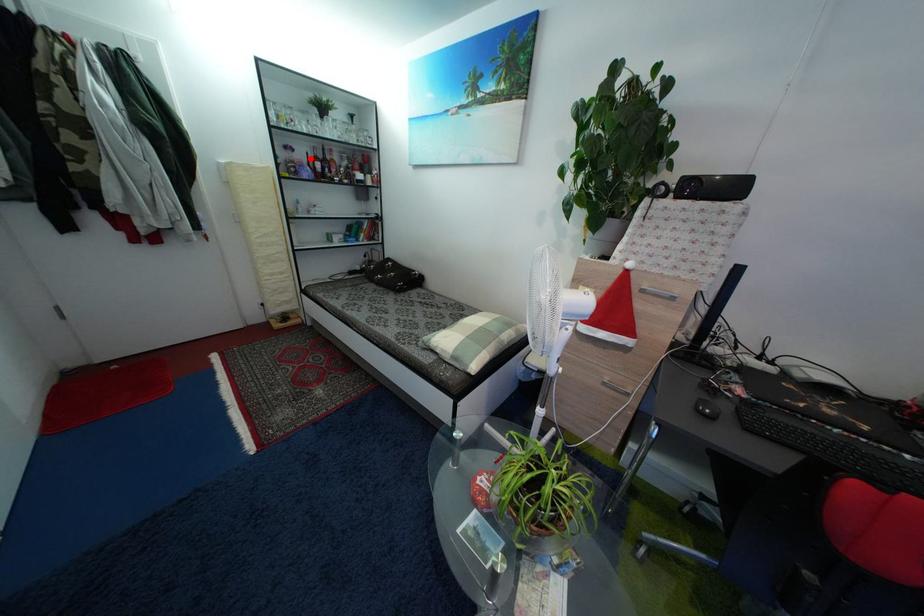
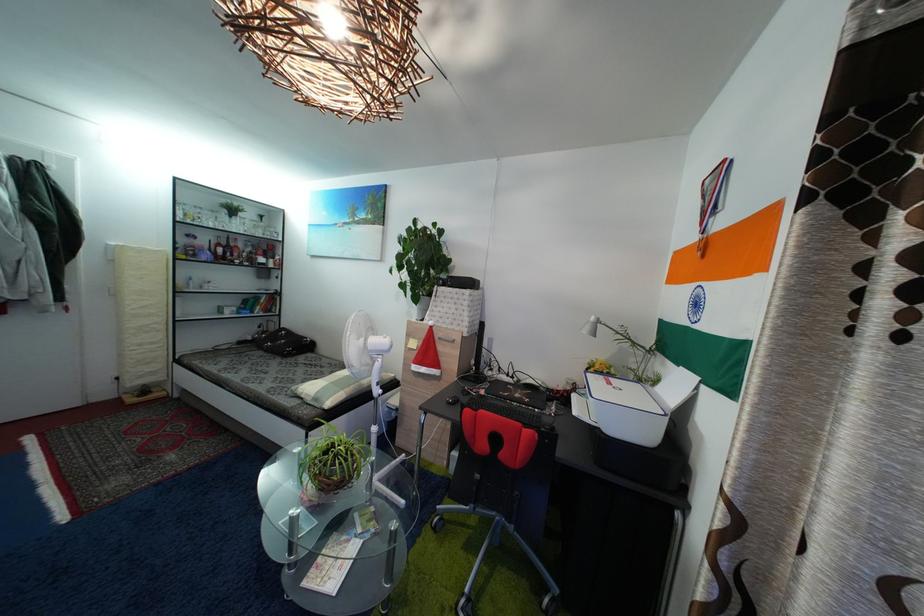
Where in the second image is the point corresponding to the highlighted location from the first image?

(213, 246)